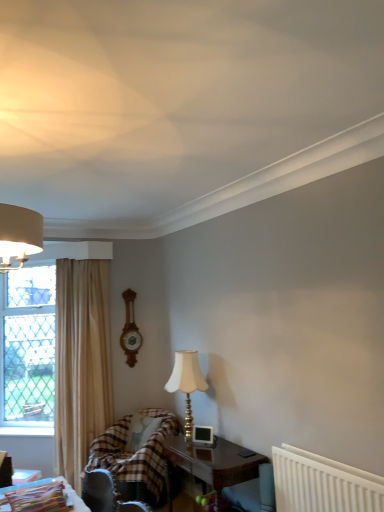
In order to face plastic magazine at lower left, the 1th table positioned from the front, should I rotate leftwards or rightwards?

Rotate your view left by about 20.053°.

What is the approximate width of plastic magazine at lower left, which is counted as the 1th table, starting from the top?

plastic magazine at lower left, which is counted as the 1th table, starting from the top, is 15.32 inches in width.

The image size is (384, 512). Describe the element at coordinates (135, 457) in the screenshot. I see `plaid fabric chair at lower left` at that location.

Describe the element at coordinates (27, 347) in the screenshot. The height and width of the screenshot is (512, 384). I see `clear glass window at left` at that location.

What do you see at coordinates (130, 330) in the screenshot? I see `wooden clock at center` at bounding box center [130, 330].

The width and height of the screenshot is (384, 512). I want to click on white fabric lampshade at center-right, so click(186, 383).

Consider the image. Measure the distance between beige fabric curtain at left and plastic magazine at lower left, the first table positioned from the left.

beige fabric curtain at left and plastic magazine at lower left, the first table positioned from the left, are 6.01 feet apart.

Considering the sizes of objects beige fabric curtain at left and plastic magazine at lower left, which appears as the second table when ordered from the bottom, in the image provided, who is smaller, beige fabric curtain at left or plastic magazine at lower left, which appears as the second table when ordered from the bottom,?

plastic magazine at lower left, which appears as the second table when ordered from the bottom, is smaller.

Is beige fabric curtain at left next to plastic magazine at lower left, the first table positioned from the left, and touching it?

No, beige fabric curtain at left is not in contact with plastic magazine at lower left, the first table positioned from the left.

Is plastic magazine at lower left, the first table positioned from the left, completely or partially inside beige fabric curtain at left?

No, plastic magazine at lower left, the first table positioned from the left, is not a part of beige fabric curtain at left.

Considering the points (50, 267) and (45, 482), which point is behind, point (50, 267) or point (45, 482)?

The point (50, 267) is behind.

Consider the image. From the image's perspective, which one is positioned lower, clear glass window at left or plastic magazine at lower left, the first table positioned from the left?

plastic magazine at lower left, the first table positioned from the left, from the image's perspective.

Is clear glass window at left in front of plastic magazine at lower left, which appears as the second table when ordered from the bottom?

That is False.

Identify the location of table that is the 1st object to the right of the clear glass window at left, starting at the anchor. (64, 490).

Is white fabric lampshade at center-right facing away from clear glass window at left?

No, white fabric lampshade at center-right is not facing away from clear glass window at left.

Does white fabric lampshade at center-right have a greater height compared to clear glass window at left?

No.

In the scene shown: Is white fabric lampshade at center-right not near clear glass window at left?

Absolutely, white fabric lampshade at center-right is distant from clear glass window at left.

Where is `window that appears above the white fabric lampshade at center-right (from the image's perspective)`? This screenshot has height=512, width=384. window that appears above the white fabric lampshade at center-right (from the image's perspective) is located at coordinates (27, 347).

Is beige fabric curtain at left further to camera compared to white fabric lampshade at center-right?

Yes, beige fabric curtain at left is further from the camera.

Is beige fabric curtain at left oriented away from white fabric lampshade at center-right?

beige fabric curtain at left does not have its back to white fabric lampshade at center-right.

Which of these two, beige fabric curtain at left or white fabric lampshade at center-right, is thinner?

white fabric lampshade at center-right is thinner.

From a real-world perspective, is white plastic radiator at lower right below plastic magazine at lower left, which is counted as the 1th table, starting from the top?

Yes, from a real-world perspective, white plastic radiator at lower right is beneath plastic magazine at lower left, which is counted as the 1th table, starting from the top.

This screenshot has width=384, height=512. What are the coordinates of `radiator that is under the plastic magazine at lower left, the first table positioned from the left (from a real-world perspective)` in the screenshot? It's located at (322, 484).

Looking at this image, from the image's perspective, is white plastic radiator at lower right above plastic magazine at lower left, which is counted as the second table, starting from the back?

Actually, white plastic radiator at lower right appears below plastic magazine at lower left, which is counted as the second table, starting from the back, in the image.

Considering the points (375, 483) and (80, 500), which point is behind, point (375, 483) or point (80, 500)?

The point (80, 500) is behind.

Is white fabric lampshade at center-right looking in the opposite direction of dark wood table at lower center, arranged as the first table when viewed from the right?

No, white fabric lampshade at center-right is not facing away from dark wood table at lower center, arranged as the first table when viewed from the right.

From the image's perspective, is white fabric lampshade at center-right above or below dark wood table at lower center, the 1th table ordered from the bottom?

Clearly, from the image's perspective, white fabric lampshade at center-right is above dark wood table at lower center, the 1th table ordered from the bottom.

Which of these two, white fabric lampshade at center-right or dark wood table at lower center, the second table viewed from the top, is thinner?

white fabric lampshade at center-right.

Identify the location of lamp lying above the dark wood table at lower center, which is counted as the 1th table, starting from the back (from the image's perspective). (186, 383).

Looking at this image, considering the sizes of objects clear glass window at left and beige fabric curtain at left in the image provided, who is smaller, clear glass window at left or beige fabric curtain at left?

Smaller between the two is clear glass window at left.

Is clear glass window at left facing away from beige fabric curtain at left?

clear glass window at left is not turned away from beige fabric curtain at left.

Who is shorter, clear glass window at left or beige fabric curtain at left?

clear glass window at left is shorter.

Is clear glass window at left in contact with beige fabric curtain at left?

No, clear glass window at left is not next to beige fabric curtain at left.

Locate an element on the screen. This screenshot has height=512, width=384. the 2nd table in front of the beige fabric curtain at left is located at coordinates (64, 490).

The width and height of the screenshot is (384, 512). I want to click on the 1st table positioned below the clear glass window at left (from the image's perspective), so click(64, 490).

Looking at the image, which one is located closer to white fabric lampshade at center-right, plaid fabric chair at lower left or dark wood table at lower center, marked as the 2th table in a front-to-back arrangement?

Based on the image, dark wood table at lower center, marked as the 2th table in a front-to-back arrangement, appears to be nearer to white fabric lampshade at center-right.

In the scene shown: Considering their positions, is beige fabric curtain at left positioned closer to white fabric lampshade at center-right than plastic magazine at lower left, the first table positioned from the left?

beige fabric curtain at left is positioned closer to the anchor white fabric lampshade at center-right.

Based on their spatial positions, is wooden clock at center or plastic magazine at lower left, the first table positioned from the left, closer to beige fabric curtain at left?

wooden clock at center.

Estimate the real-world distances between objects in this image. Which object is closer to white plastic radiator at lower right, wooden clock at center or plastic magazine at lower left, which appears as the second table when ordered from the bottom?

plastic magazine at lower left, which appears as the second table when ordered from the bottom, is closer to white plastic radiator at lower right.

Based on their spatial positions, is dark wood table at lower center, the second table viewed from the top, or white fabric lampshade at center-right closer to clear glass window at left?

Based on the image, white fabric lampshade at center-right appears to be nearer to clear glass window at left.

Based on their spatial positions, is clear glass window at left or dark wood table at lower center, marked as the 2th table in a front-to-back arrangement, closer to plastic magazine at lower left, the first table positioned from the left?

Based on the image, dark wood table at lower center, marked as the 2th table in a front-to-back arrangement, appears to be nearer to plastic magazine at lower left, the first table positioned from the left.

Which object lies nearer to the anchor point wooden clock at center, dark wood table at lower center, which is counted as the 1th table, starting from the back, or clear glass window at left?

clear glass window at left lies closer to wooden clock at center than the other object.

Looking at the image, which one is located further to wooden clock at center, white plastic radiator at lower right or beige fabric curtain at left?

white plastic radiator at lower right.

The image size is (384, 512). I want to click on window located between white plastic radiator at lower right and wooden clock at center in the depth direction, so click(27, 347).

Where is `chair between plastic magazine at lower left, which is the second table in right-to-left order, and white plastic radiator at lower right from left to right`? This screenshot has height=512, width=384. chair between plastic magazine at lower left, which is the second table in right-to-left order, and white plastic radiator at lower right from left to right is located at coordinates pyautogui.click(x=135, y=457).

I want to click on lamp between beige fabric curtain at left and dark wood table at lower center, which is counted as the 1th table, starting from the back, from left to right, so click(x=186, y=383).

Locate an element on the screen. chair situated between clear glass window at left and dark wood table at lower center, arranged as the first table when viewed from the right, from left to right is located at coordinates (135, 457).